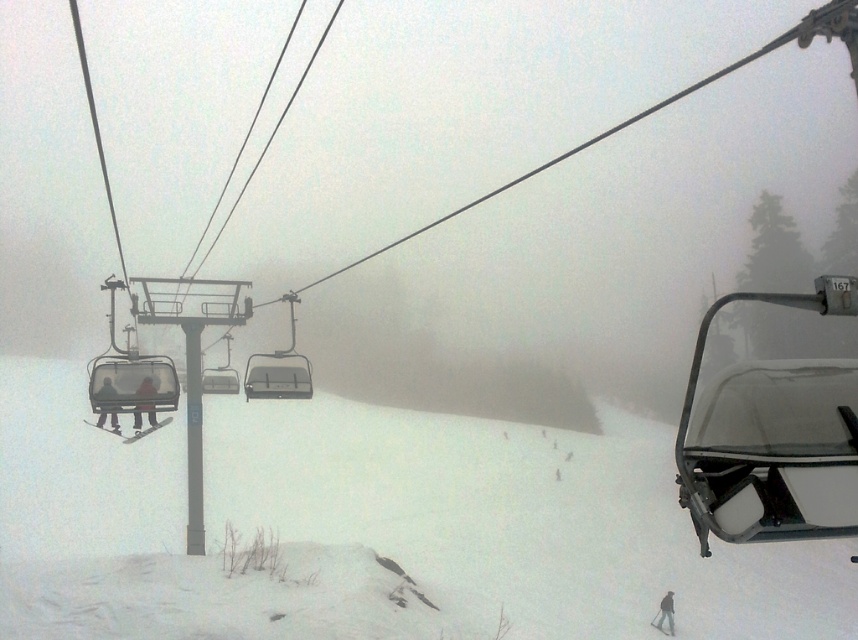
Is transparent plastic seat at center bigger than metallic gray ski lift at center?

Yes, transparent plastic seat at center is bigger than metallic gray ski lift at center.

Is point (769, 476) closer to camera compared to point (257, 372)?

Yes, it is in front of point (257, 372).

The height and width of the screenshot is (640, 858). I want to click on transparent plastic seat at center, so click(x=772, y=417).

Based on the photo, can you confirm if dark gray snow pants at lower right is smaller than white matte ski at lower left?

Indeed, dark gray snow pants at lower right has a smaller size compared to white matte ski at lower left.

Is dark gray snow pants at lower right wider than white matte ski at lower left?

In fact, dark gray snow pants at lower right might be narrower than white matte ski at lower left.

Which is in front, point (666, 616) or point (150, 429)?

Point (150, 429) is more forward.

You are a GUI agent. You are given a task and a screenshot of the screen. Output one action in this format:
    pyautogui.click(x=<x>, y=<y>)
    Task: Click on the dark gray snow pants at lower right
    The image size is (858, 640).
    Given the screenshot: What is the action you would take?
    pyautogui.click(x=665, y=612)

Can you confirm if matte black ski at left is positioned above white matte ski at lower center?

Correct, matte black ski at left is located above white matte ski at lower center.

Can you confirm if matte black ski at left is positioned to the right of white matte ski at lower center?

In fact, matte black ski at left is to the left of white matte ski at lower center.

Locate an element on the screen. matte black ski at left is located at coordinates (107, 429).